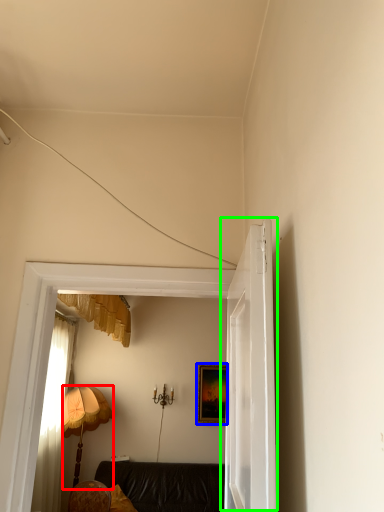
Question: Estimate the real-world distances between objects in this image. Which object is closer to lamp (highlighted by a red box), picture frame (highlighted by a blue box) or door (highlighted by a green box)?

Choices:
 (A) picture frame
 (B) door

Answer: (A)